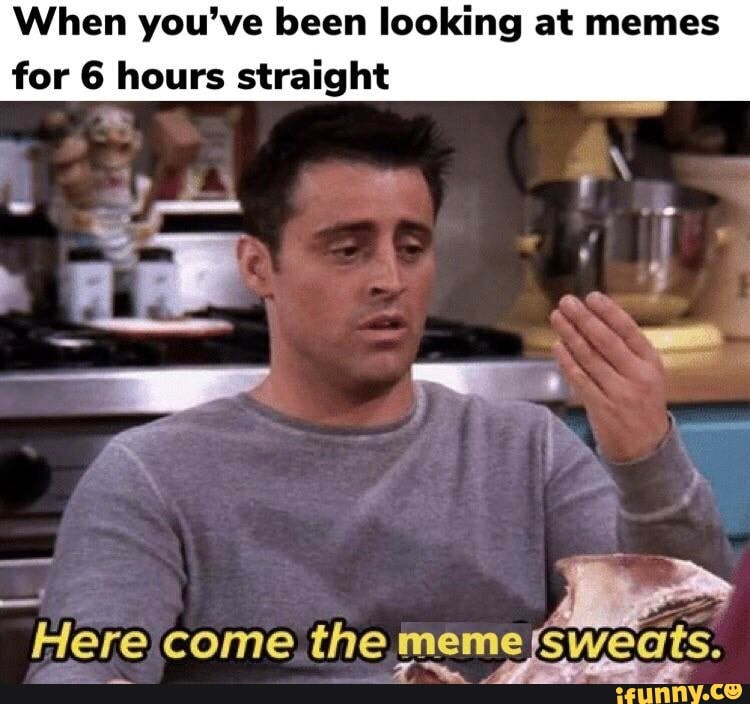
Where is `stand mixer`? The width and height of the screenshot is (750, 704). stand mixer is located at coordinates (583, 120), (667, 339), (528, 317), (628, 272).